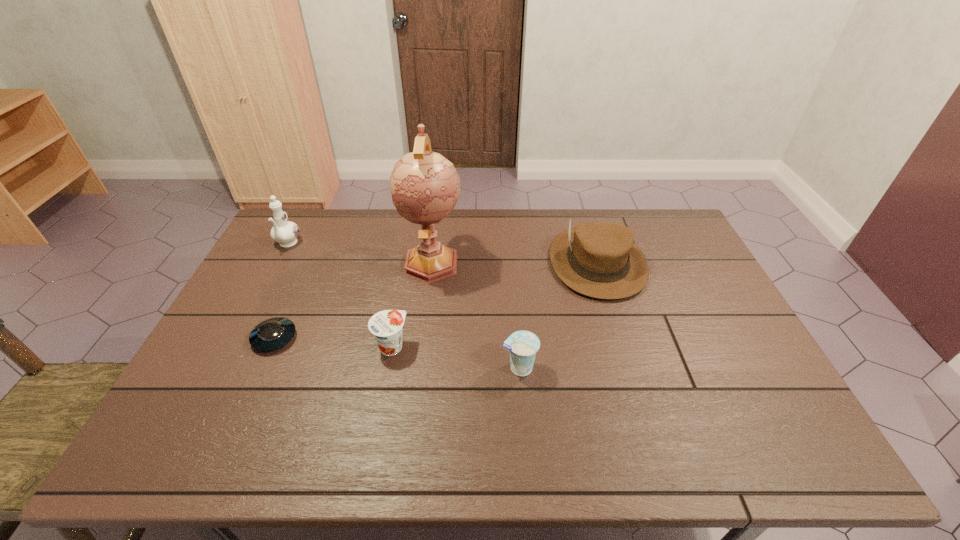
In the image, there is a desktop. Identify the location of vacant region at the left edge. (206, 384).

This screenshot has height=540, width=960. Identify the location of free space at the right edge. (685, 268).

Find the location of `vacant space at the far left corner of the desktop`. vacant space at the far left corner of the desktop is located at coordinates (319, 233).

In the image, there is a desktop. At what (x,y) coordinates should I click in order to perform the action: click on vacant space at the near left corner. Please return your answer as a coordinate pair (x, y). This screenshot has width=960, height=540. Looking at the image, I should click on (186, 434).

Identify the location of vacant space at the near right corner of the desktop. (756, 449).

Find the location of a particular element. vacant space in between the saucer and the fedora is located at coordinates (436, 300).

You are a GUI agent. You are given a task and a screenshot of the screen. Output one action in this format:
    pyautogui.click(x=<x>, y=<y>)
    Task: Click on the unoccupied position between the chinaware and the globe
    The image size is (960, 540).
    Given the screenshot: What is the action you would take?
    pyautogui.click(x=360, y=253)

The width and height of the screenshot is (960, 540). Find the location of `vacant space that's between the right yogurt and the chinaware`. vacant space that's between the right yogurt and the chinaware is located at coordinates (403, 306).

Where is `empty location between the shortest object and the chinaware`? empty location between the shortest object and the chinaware is located at coordinates (281, 291).

Identify the location of free space between the fifth object from left to right and the globe. The width and height of the screenshot is (960, 540). (475, 315).